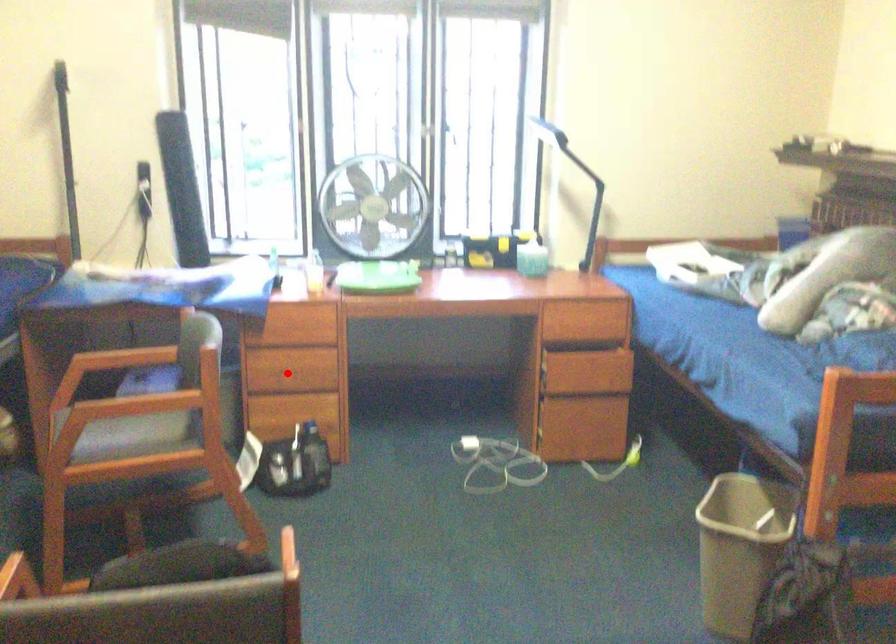
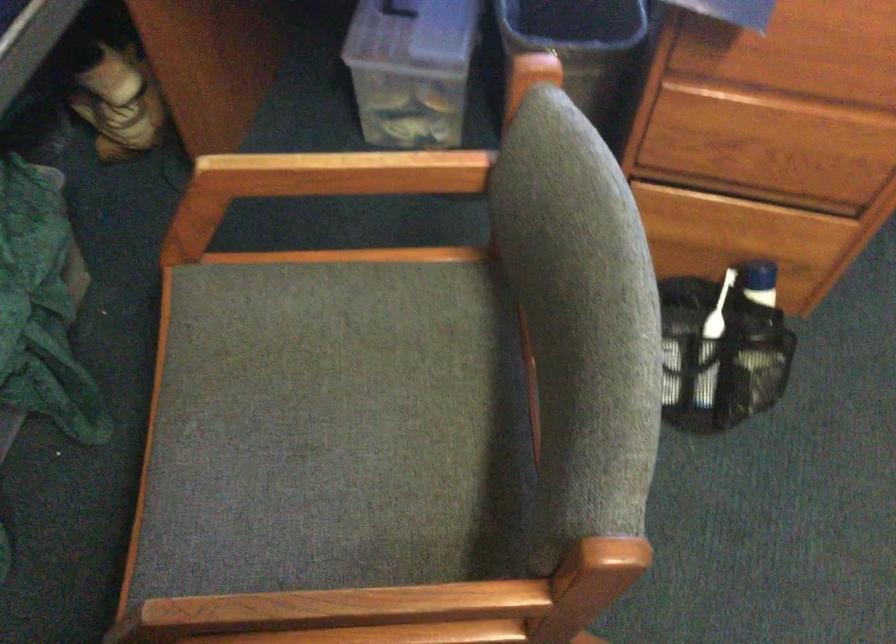
Find the pixel in the second image that matches the highlighted location in the first image.

(751, 147)